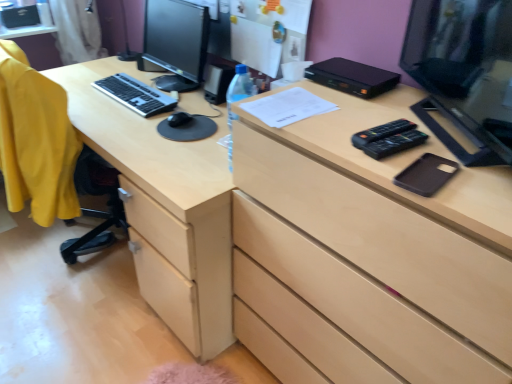
This screenshot has width=512, height=384. What are the coordinates of `blank space situated above white paper at center (from a real-world perspective)` in the screenshot? It's located at (290, 96).